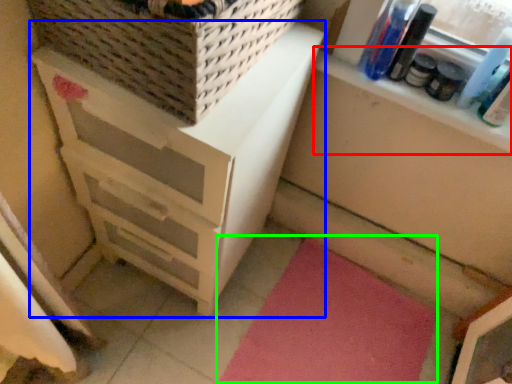
Question: Based on their relative distances, which object is farther from window sill (highlighted by a red box)? Choose from chest of drawers (highlighted by a blue box) and yoga mat (highlighted by a green box).

Choices:
 (A) chest of drawers
 (B) yoga mat

Answer: (B)